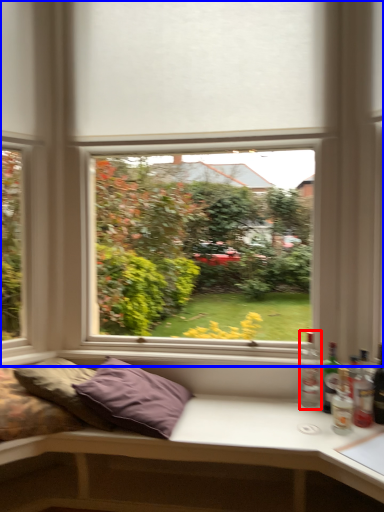
Question: Which of the following is the farthest to the observer, bottle (highlighted by a red box) or window (highlighted by a blue box)?

Choices:
 (A) bottle
 (B) window

Answer: (A)